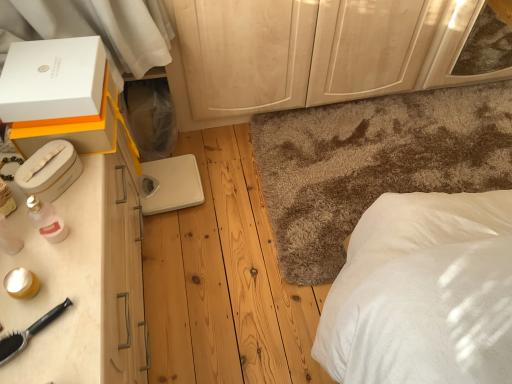
The image size is (512, 384). In order to click on free spot in front of light wood dresser at center in this screenshot , I will do `click(312, 168)`.